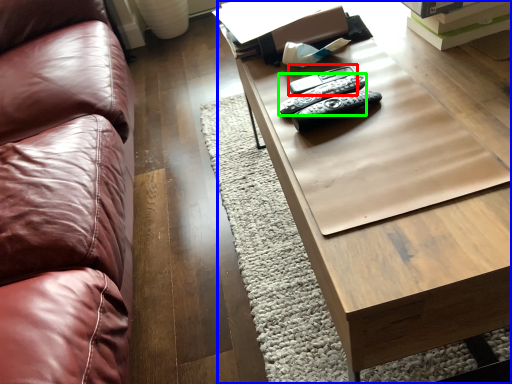
Question: Which object is positioned farthest from remote (highlighted by a red box)? Select from table (highlighted by a blue box) and remote (highlighted by a green box).

Choices:
 (A) table
 (B) remote

Answer: (A)